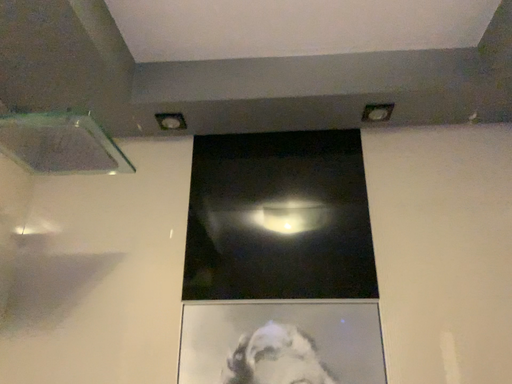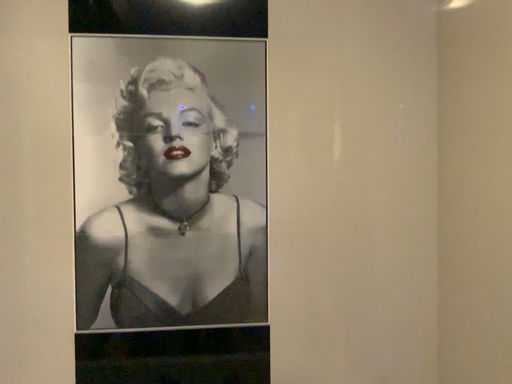
Question: Which way did the camera rotate in the video?

Choices:
 (A) rotated upward
 (B) rotated downward

Answer: (B)